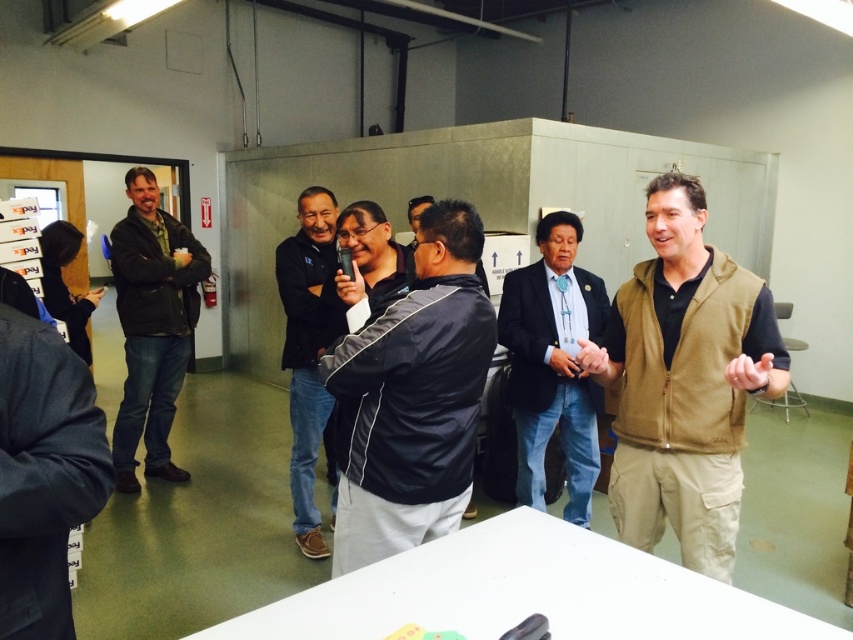
The image size is (853, 640). Describe the element at coordinates (412, 397) in the screenshot. I see `black matte jacket at center` at that location.

Which is more to the right, black matte jacket at center or dark brown leather jacket at left?

Positioned to the right is black matte jacket at center.

Does point (393, 380) come closer to viewer compared to point (140, 296)?

Yes, point (393, 380) is closer to viewer.

What are the coordinates of `black matte jacket at center` in the screenshot? It's located at (412, 397).

Is tan fleece vest at center positioned in front of dark brown leather jacket at left?

That is True.

Does tan fleece vest at center come behind dark brown leather jacket at left?

That is False.

Is point (663, 406) in front of point (112, 237)?

That is True.

I want to click on tan fleece vest at center, so click(x=683, y=381).

Looking at this image, does white glossy table at lower center have a greater width compared to dark blue jacket at center?

Correct, the width of white glossy table at lower center exceeds that of dark blue jacket at center.

Is white glossy table at lower center smaller than dark blue jacket at center?

Indeed, white glossy table at lower center has a smaller size compared to dark blue jacket at center.

The image size is (853, 640). I want to click on white glossy table at lower center, so click(523, 593).